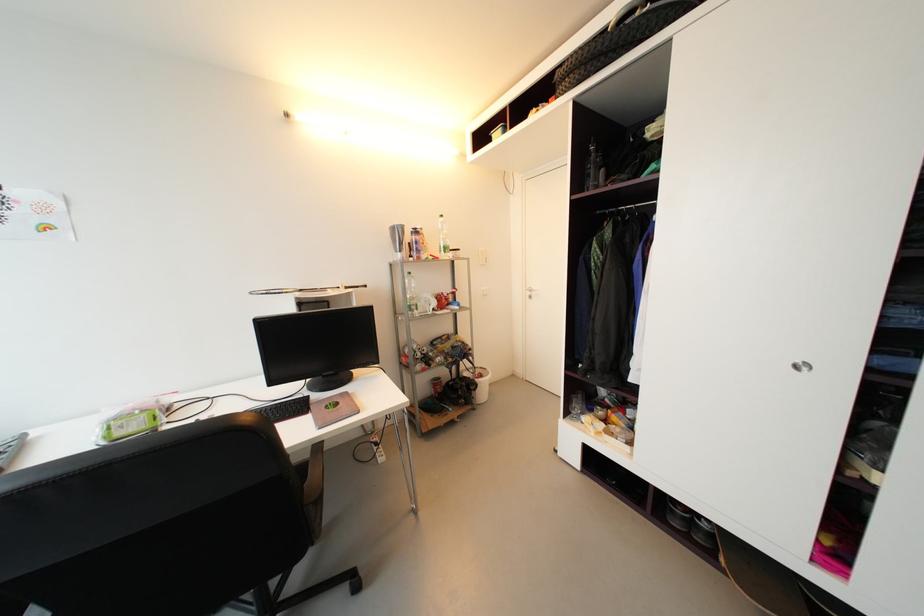
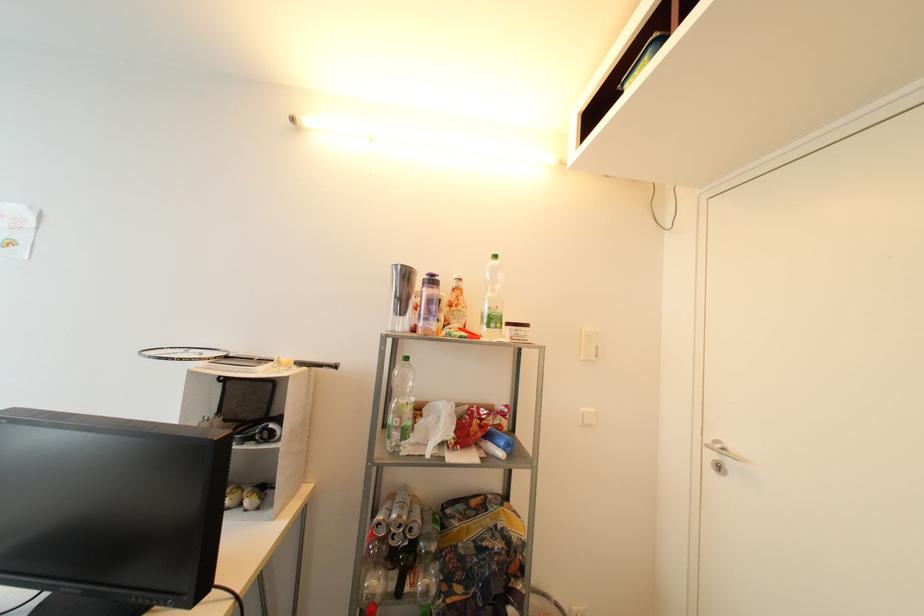
The point at (x=420, y=233) is marked in the first image. Where is the corresponding point in the second image?

(438, 283)